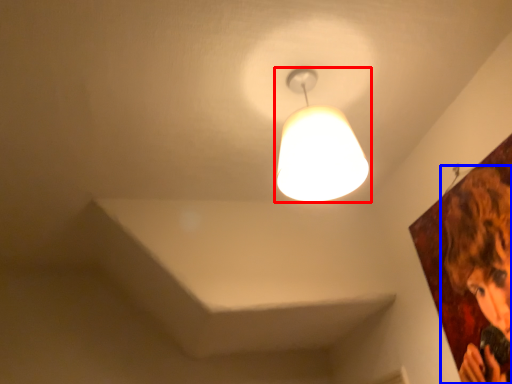
Question: Which point is further to the camera, lamp (highlighted by a red box) or person (highlighted by a blue box)?

Choices:
 (A) lamp
 (B) person

Answer: (A)